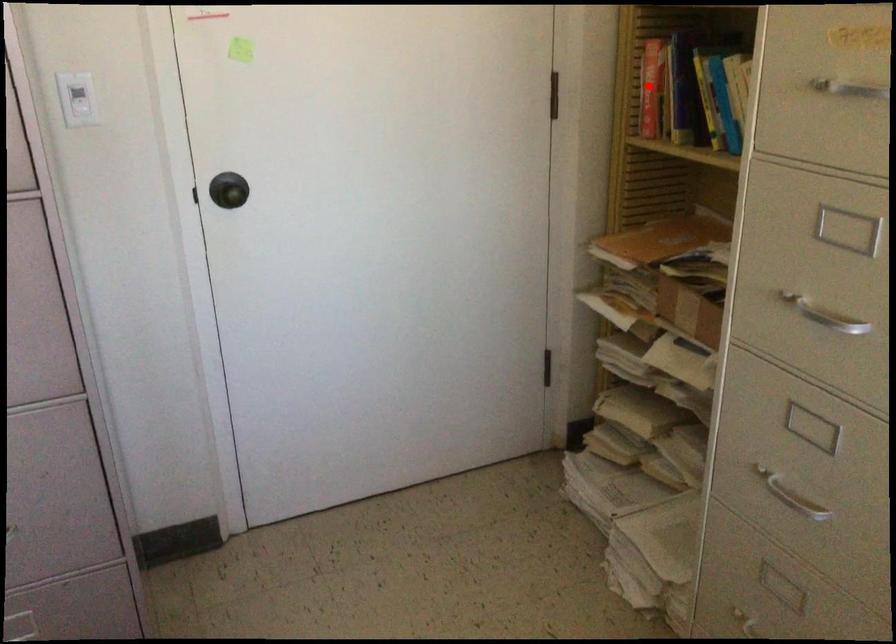
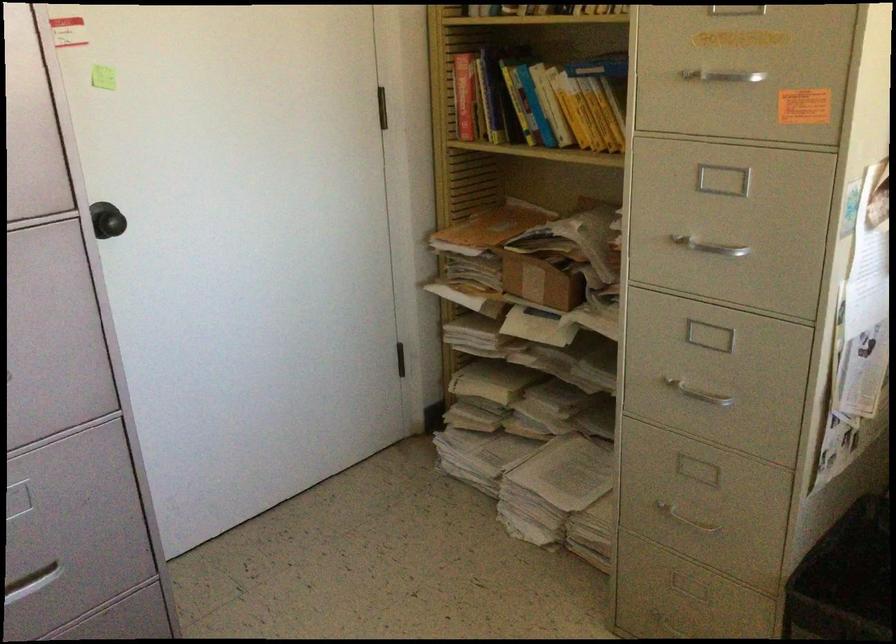
Question: I am providing you with two images of the same scene from different viewpoints. Given a red point in image1, look at the same physical point in image2. Is it:

Choices:
 (A) Closer to the viewpoint
 (B) Farther from the viewpoint

Answer: (B)